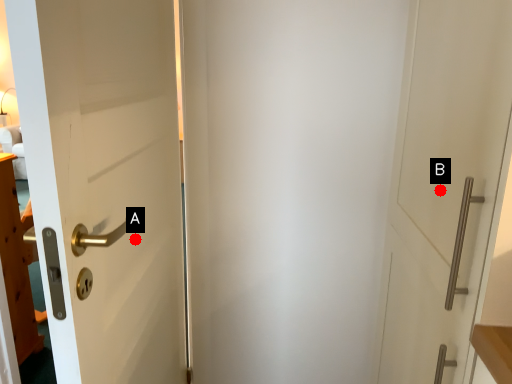
Question: Two points are circled on the image, labeled by A and B beside each circle. Which of the following is the farthest from the observer?

Choices:
 (A) A is further
 (B) B is further

Answer: (A)